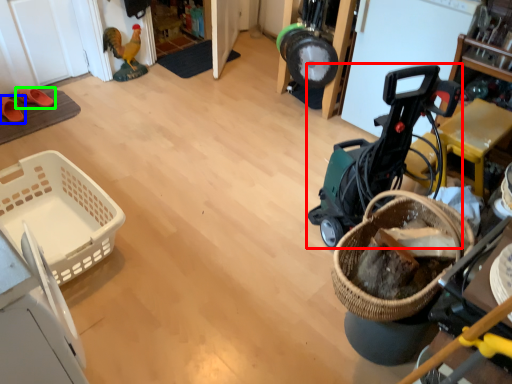
Question: Which object is positioned closest to baby carriage (highlighted by a red box)? Select from footwear (highlighted by a blue box) and footwear (highlighted by a green box).

Choices:
 (A) footwear
 (B) footwear

Answer: (B)